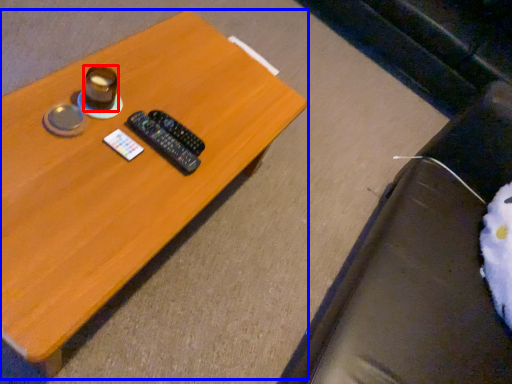
Question: Among these objects, which one is nearest to the camera, coffee cup (highlighted by a red box) or table (highlighted by a blue box)?

Choices:
 (A) coffee cup
 (B) table

Answer: (B)